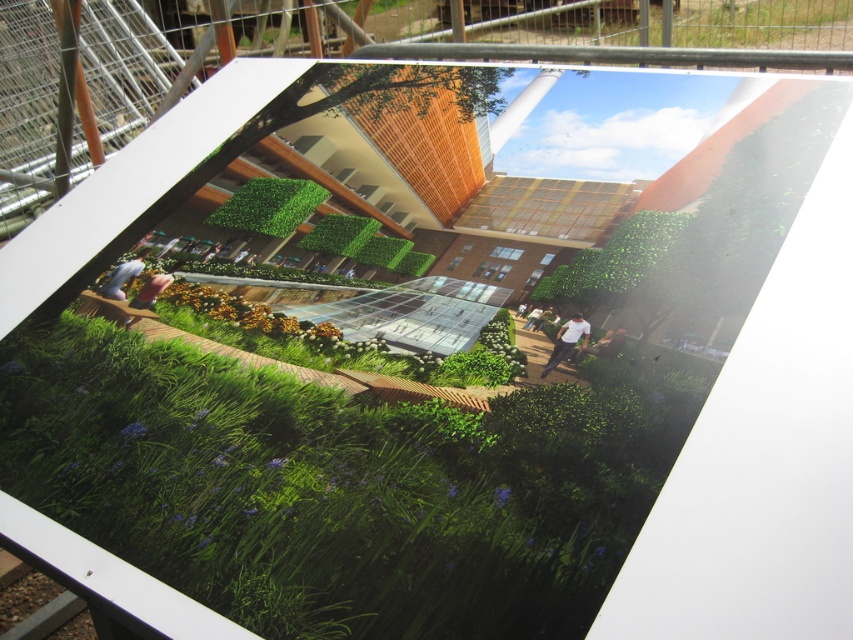
Question: Which point appears closest to the camera in this image?

Choices:
 (A) (231, 397)
 (B) (543, 372)

Answer: (B)

Question: Is green grass at center above white cotton shirt at center?

Choices:
 (A) no
 (B) yes

Answer: (A)

Question: Among these points, which one is nearest to the camera?

Choices:
 (A) (161, 465)
 (B) (575, 317)

Answer: (A)

Question: Is green grass at center to the left of white cotton shirt at center from the viewer's perspective?

Choices:
 (A) yes
 (B) no

Answer: (A)

Question: Does green grass at center lie in front of white cotton shirt at center?

Choices:
 (A) yes
 (B) no

Answer: (A)